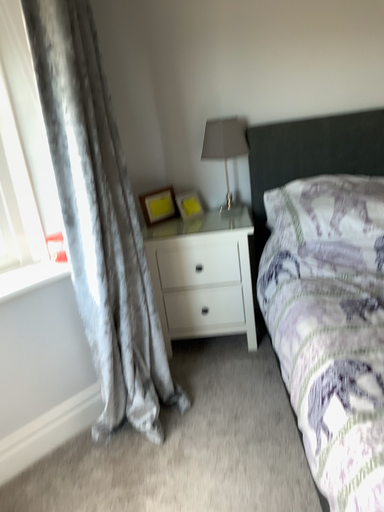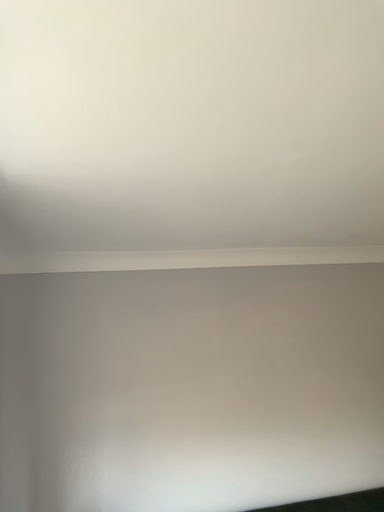
Question: How did the camera likely rotate when shooting the video?

Choices:
 (A) rotated left
 (B) rotated right

Answer: (B)